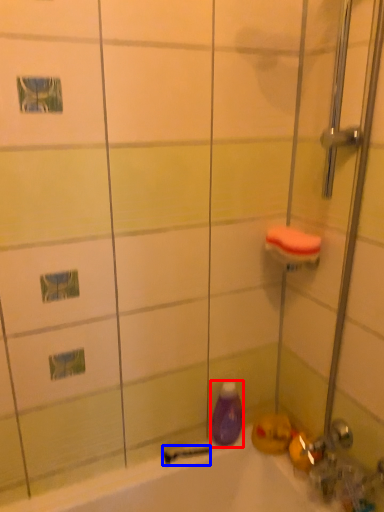
Question: Which point is closer to the camera, cleaning product (highlighted by a red box) or shower (highlighted by a blue box)?

Choices:
 (A) cleaning product
 (B) shower

Answer: (A)